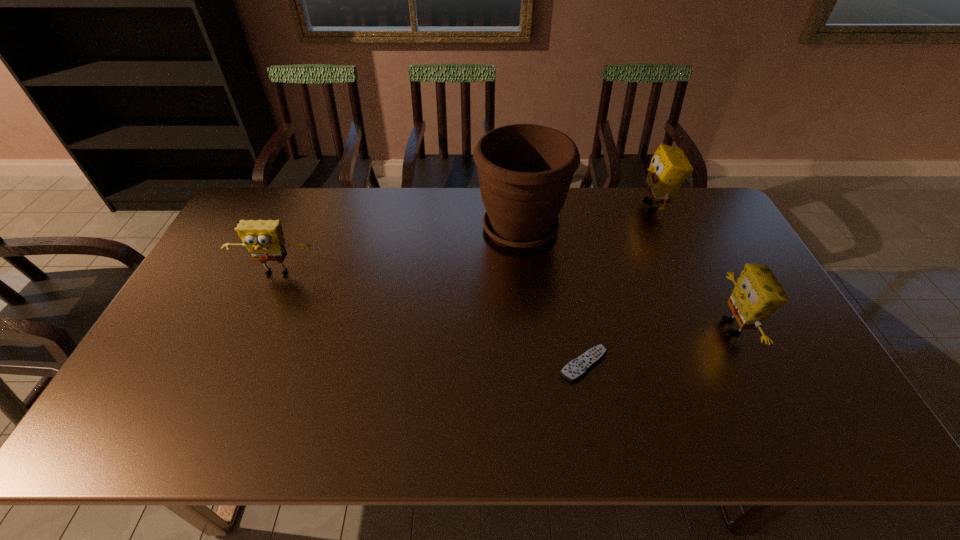
The image size is (960, 540). Find the location of `free space between the farthest sponge and the nearest sponge`. free space between the farthest sponge and the nearest sponge is located at coordinates (693, 266).

Where is `unoccupied position between the leftmost sponge and the shortest object`? This screenshot has height=540, width=960. unoccupied position between the leftmost sponge and the shortest object is located at coordinates [x=430, y=319].

This screenshot has width=960, height=540. Identify the location of vacant region between the leftmost sponge and the nearest sponge. (504, 301).

Choose which object is the nearest neighbor to the second nearest sponge. Please provide its 2D coordinates. Your answer should be formatted as a tuple, i.e. [(x, y)], where the tuple contains the x and y coordinates of a point satisfying the conditions above.

[(525, 170)]

Select which object is the closest to the nearest sponge. Please provide its 2D coordinates. Your answer should be formatted as a tuple, i.e. [(x, y)], where the tuple contains the x and y coordinates of a point satisfying the conditions above.

[(575, 369)]

Identify which sponge is the closest to the remote control. Please provide its 2D coordinates. Your answer should be formatted as a tuple, i.e. [(x, y)], where the tuple contains the x and y coordinates of a point satisfying the conditions above.

[(757, 294)]

Where is `sponge that stands as the second closest to the leftmost sponge`? This screenshot has width=960, height=540. sponge that stands as the second closest to the leftmost sponge is located at coordinates (757, 294).

At what (x,y) coordinates should I click in order to perform the action: click on vacant point that satisfies the following two spatial constraints: 1. on the face of the farthest sponge; 2. on the face of the third nearest object. Please return your answer as a coordinate pair (x, y). The image size is (960, 540). Looking at the image, I should click on (684, 274).

Locate an element on the screen. This screenshot has height=540, width=960. vacant space that satisfies the following two spatial constraints: 1. on the face of the farthest sponge; 2. on the front side of the tallest object is located at coordinates (663, 228).

Locate an element on the screen. This screenshot has height=540, width=960. free spot that satisfies the following two spatial constraints: 1. on the face of the farthest sponge; 2. on the front side of the flowerpot is located at coordinates (663, 228).